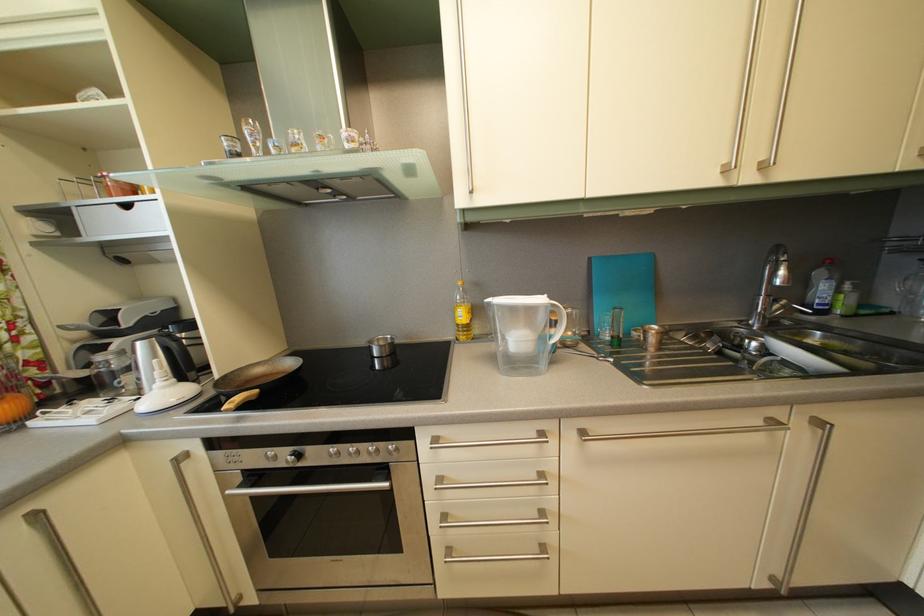
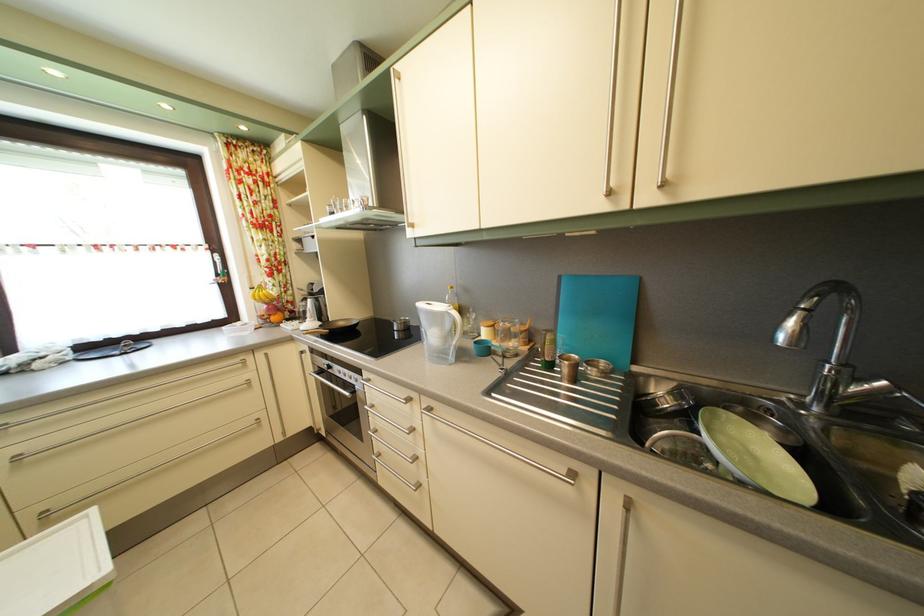
Locate, in the second image, the point that corresponds to the point at 661,347 in the first image.

(574, 378)